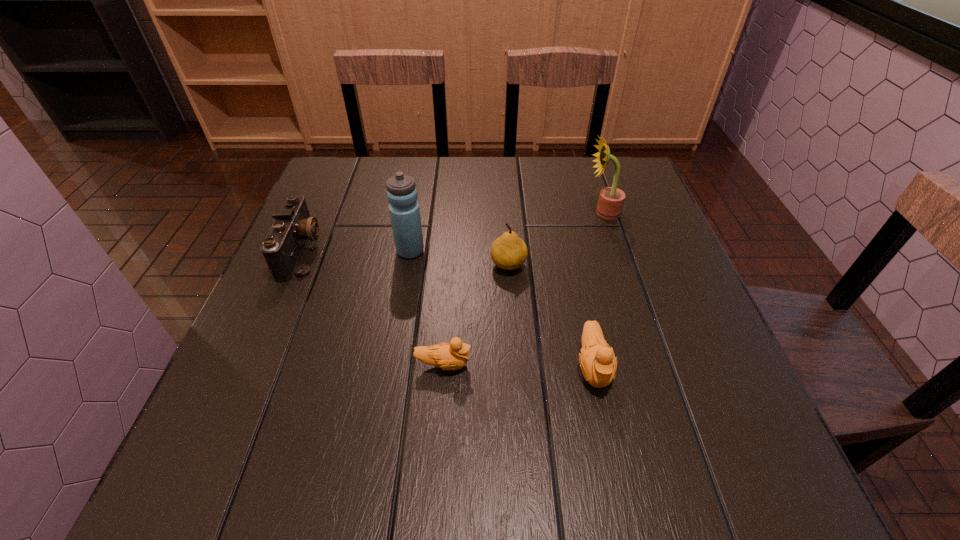
The height and width of the screenshot is (540, 960). What are the coordinates of `vacant space situated 0.090m on the face of the rightmost object` in the screenshot? It's located at (550, 212).

At what (x,y) coordinates should I click in order to perform the action: click on free region located on the face of the rightmost object. Please return your answer as a coordinate pair (x, y). The width and height of the screenshot is (960, 540). Looking at the image, I should click on (495, 212).

I want to click on vacant space situated on the back of the water bottle, so click(420, 192).

The width and height of the screenshot is (960, 540). I want to click on free region located 0.070m on the front-facing side of the camera, so click(x=349, y=251).

Where is `free space located on the left of the third object from right to left`? Image resolution: width=960 pixels, height=540 pixels. free space located on the left of the third object from right to left is located at coordinates [441, 265].

You are a GUI agent. You are given a task and a screenshot of the screen. Output one action in this format:
    pyautogui.click(x=<x>, y=<y>)
    Task: Click on the object present at the far edge
    The image size is (960, 540).
    Given the screenshot: What is the action you would take?
    click(611, 199)

Where is `object located at the near edge`? This screenshot has height=540, width=960. object located at the near edge is located at coordinates coord(598,363).

At what (x,y) coordinates should I click in order to perform the action: click on object located at the left edge. Please return your answer as a coordinate pair (x, y). Looking at the image, I should click on (283, 246).

Where is `object positioned at the right edge`? The width and height of the screenshot is (960, 540). object positioned at the right edge is located at coordinates (611, 199).

The image size is (960, 540). What are the coordinates of `object that is at the far right corner` in the screenshot? It's located at (611, 199).